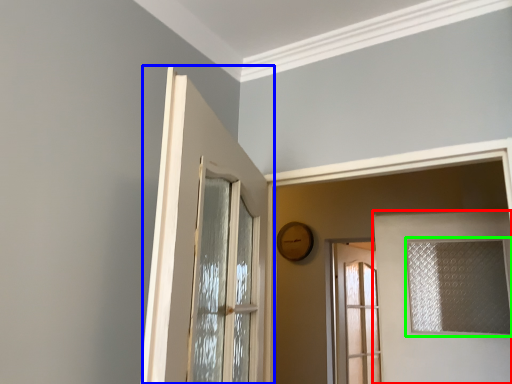
Question: Which object is positioned farthest from door (highlighted by a red box)? Select from door (highlighted by a blue box) and window (highlighted by a green box).

Choices:
 (A) door
 (B) window

Answer: (A)